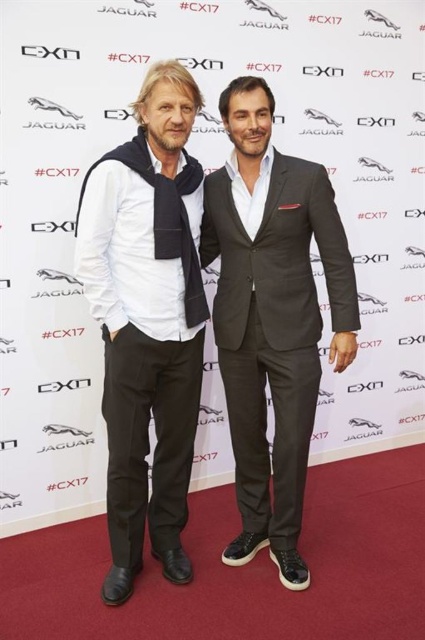
You are standing at the camera position and want to take a photo of the two men. If you move 2 feet closer to the point at (136, 509), how far will you be from that point?

The point at (136, 509) is initially 6.98 feet away from the camera. Moving 2 feet closer reduces the distance to 4.98 feet.

You are organizing a photo shoot and need to ensure that the matte black scarf at left and dark gray suit at center are visible in the frame. Given that the camera has a limited field of view, which item requires more horizontal space to fully capture in the photo?

The dark gray suit at center requires more horizontal space because its width is greater than the matte black scarf at left.

What is the exact location of the matte black scarf at left in the image?

The matte black scarf at left is located at point (x=147, y=321).